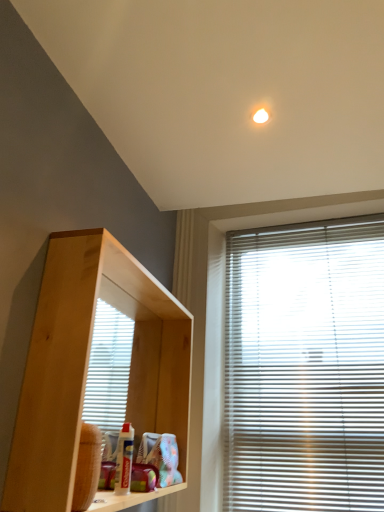
Question: Is natural wood shelf at center positioned in front of white plastic blinds at right?

Choices:
 (A) yes
 (B) no

Answer: (A)

Question: Is natural wood shelf at center in contact with white plastic blinds at right?

Choices:
 (A) yes
 (B) no

Answer: (B)

Question: Does natural wood shelf at center have a greater width compared to white plastic blinds at right?

Choices:
 (A) no
 (B) yes

Answer: (B)

Question: From the image's perspective, is natural wood shelf at center located beneath white plastic blinds at right?

Choices:
 (A) yes
 (B) no

Answer: (B)

Question: Considering the relative sizes of natural wood shelf at center and white plastic blinds at right in the image provided, is natural wood shelf at center thinner than white plastic blinds at right?

Choices:
 (A) yes
 (B) no

Answer: (B)

Question: Is white plastic blinds at right located within natural wood shelf at center?

Choices:
 (A) no
 (B) yes

Answer: (A)

Question: Does white plastic blinds at right have a lesser width compared to natural wood shelf at center?

Choices:
 (A) no
 (B) yes

Answer: (B)

Question: Is white plastic blinds at right further to the viewer compared to natural wood shelf at center?

Choices:
 (A) yes
 (B) no

Answer: (A)

Question: From the image's perspective, does white plastic blinds at right appear higher than natural wood shelf at center?

Choices:
 (A) yes
 (B) no

Answer: (B)

Question: Is white plastic blinds at right outside of natural wood shelf at center?

Choices:
 (A) no
 (B) yes

Answer: (B)

Question: Is natural wood shelf at center a part of white plastic blinds at right?

Choices:
 (A) yes
 (B) no

Answer: (B)

Question: From a real-world perspective, is white plastic blinds at right located higher than natural wood shelf at center?

Choices:
 (A) no
 (B) yes

Answer: (B)

Question: Which is correct: natural wood shelf at center is inside white plastic blinds at right, or outside of it?

Choices:
 (A) outside
 (B) inside

Answer: (A)